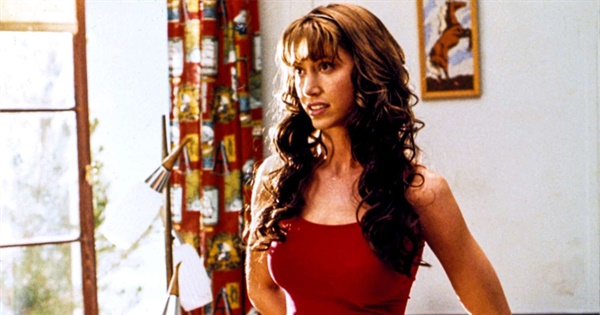
The height and width of the screenshot is (315, 600). Find the location of `white wall behind woman`. white wall behind woman is located at coordinates (511, 137).